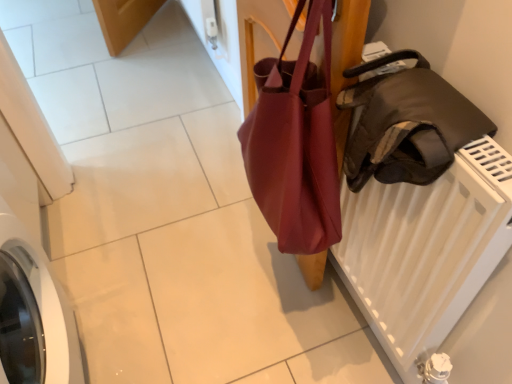
Locate an element on the screen. The image size is (512, 384). empty space that is ontop of leather jacket at right (from a real-world perspective) is located at coordinates (426, 96).